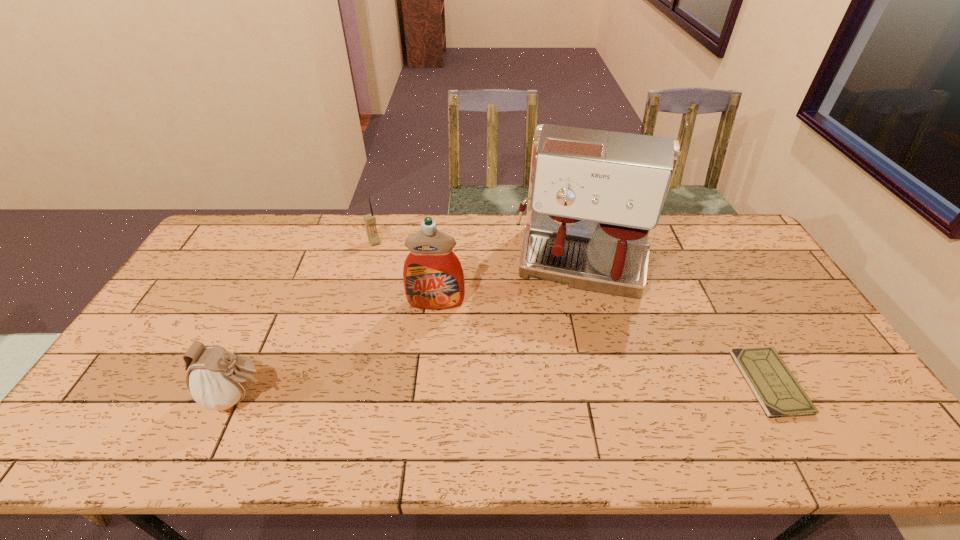
Locate an element on the screen. the leftmost object is located at coordinates (218, 379).

What are the coordinates of `the shortest object` in the screenshot? It's located at (778, 392).

Locate an element on the screen. checkbook is located at coordinates (778, 392).

Where is `cellular telephone`? cellular telephone is located at coordinates (370, 221).

Locate an element on the screen. This screenshot has height=540, width=960. the third object from right to left is located at coordinates (433, 277).

Where is `the second tallest object`? This screenshot has width=960, height=540. the second tallest object is located at coordinates (433, 277).

This screenshot has width=960, height=540. What are the coordinates of `coffee maker` in the screenshot? It's located at (595, 197).

What are the coordinates of `the tallest object` in the screenshot? It's located at click(595, 197).

The width and height of the screenshot is (960, 540). What are the coordinates of `free space located on the front-facing side of the leftmost object` in the screenshot? It's located at (365, 396).

Image resolution: width=960 pixels, height=540 pixels. In order to click on free space located on the left of the shortest object in this screenshot , I will do `click(627, 382)`.